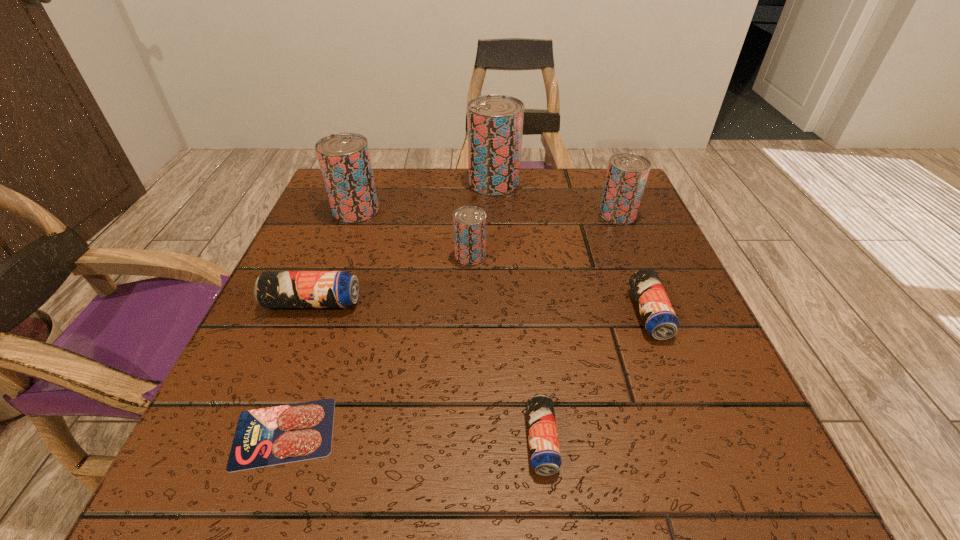
The height and width of the screenshot is (540, 960). Identify the location of free space between the farthest red beer can and the sixth tallest object. [571, 248].

Image resolution: width=960 pixels, height=540 pixels. I want to click on free area in between the smallest red beer can and the fifth shortest beer can, so (x=544, y=235).

Identify the location of vacant point located between the second blue beer can from right to left and the farthest red beer can. The height and width of the screenshot is (540, 960). pyautogui.click(x=517, y=312).

The width and height of the screenshot is (960, 540). Find the location of `free spot between the biggest blue beer can and the second blue beer can from right to left`. free spot between the biggest blue beer can and the second blue beer can from right to left is located at coordinates (427, 372).

This screenshot has height=540, width=960. In order to click on free space between the third tallest object and the second tallest beer can in this screenshot , I will do pyautogui.click(x=487, y=212).

At what (x,y) coordinates should I click in order to perform the action: click on object that is the fifth nearest to the shortest beer can. Please return your answer as a coordinate pair (x, y). The image size is (960, 540). Looking at the image, I should click on (627, 173).

In order to click on the second closest object relative to the second tallest beer can in this screenshot , I will do `click(495, 122)`.

Identify which beer can is the second nearest to the fourth farthest beer can. Please provide its 2D coordinates. Your answer should be formatted as a tuple, i.e. [(x, y)], where the tuple contains the x and y coordinates of a point satisfying the conditions above.

[(495, 122)]

Find the location of a particular element. Image resolution: width=960 pixels, height=540 pixels. the third closest beer can to the third shortest object is located at coordinates (469, 222).

Find the location of a particular element. This screenshot has width=960, height=540. the third closest red beer can to the fourth farthest object is located at coordinates (627, 173).